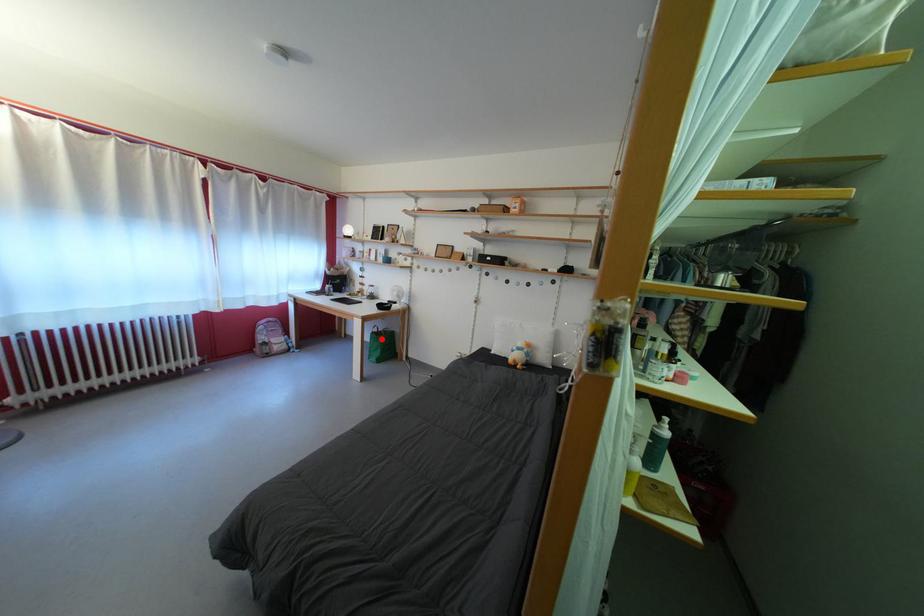
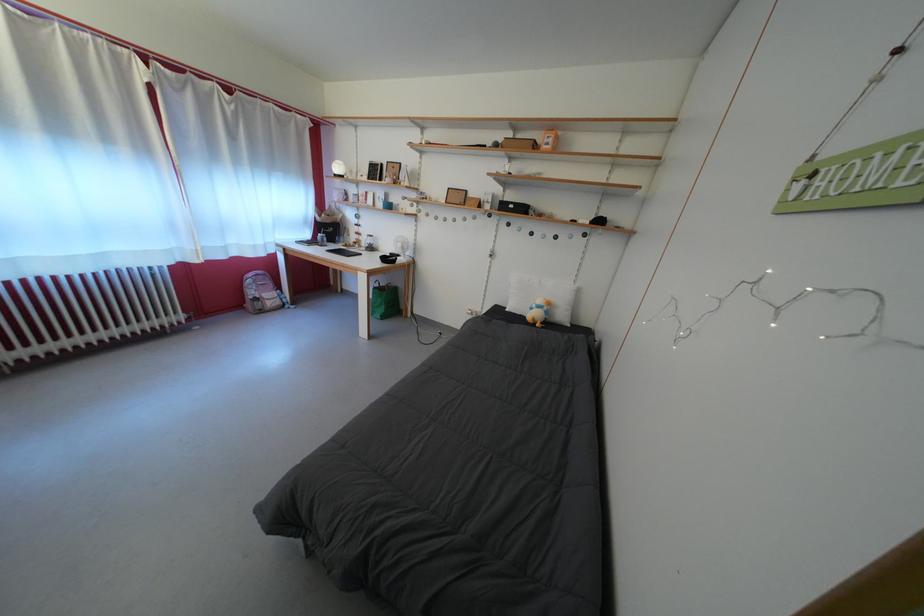
Question: I am providing you with two images of the same scene from different viewpoints. Image1 has a red point marked. In image2, the corresponding 3D location appears at what relative position? Reply with the corresponding letter.

Choices:
 (A) Closer
 (B) Farther

Answer: (A)